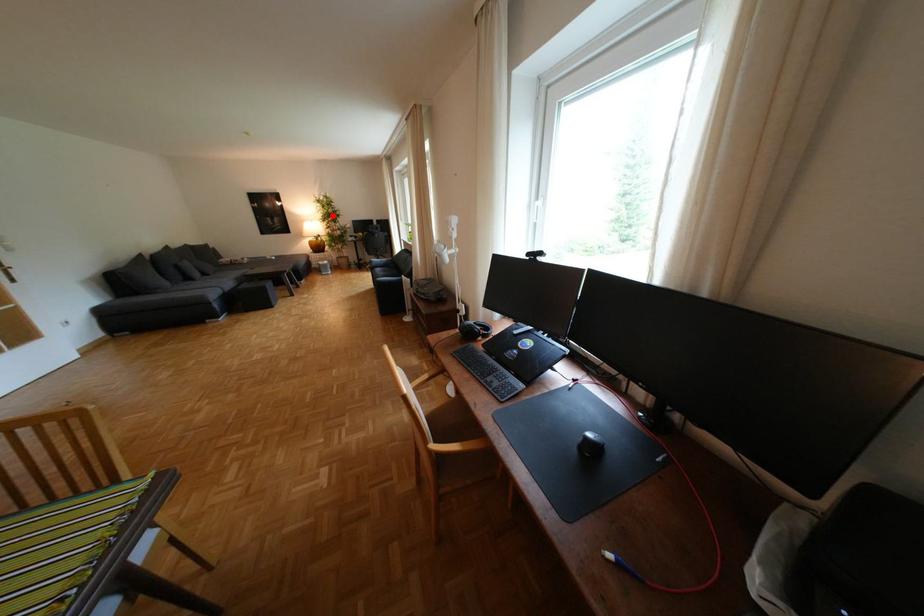
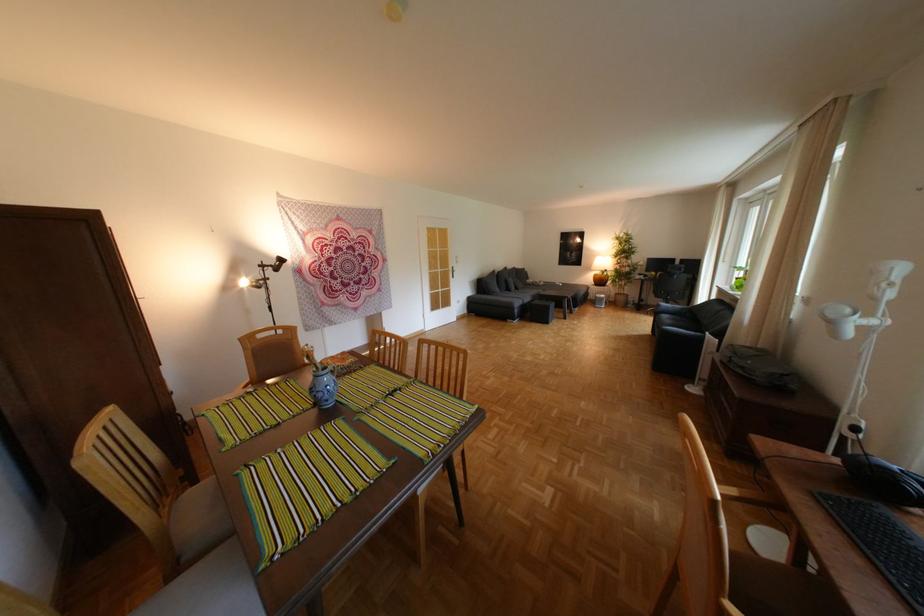
Question: A red point is marked in image1. In image2, is the corresponding 3D point closer to the camera or farther? Reply with the corresponding letter.

Choices:
 (A) The corresponding 3D point is closer.
 (B) The corresponding 3D point is farther.

Answer: (B)